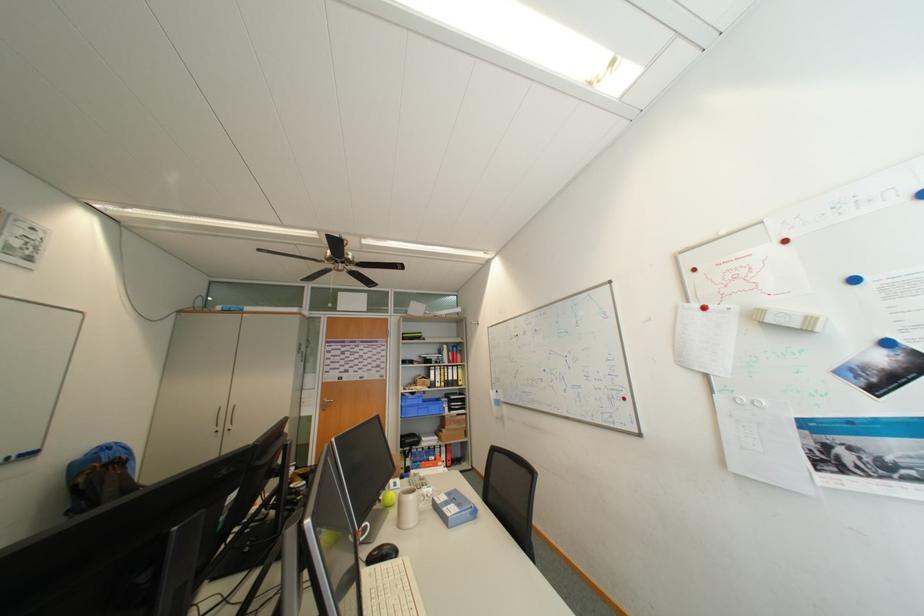
The width and height of the screenshot is (924, 616). What do you see at coordinates (517, 533) in the screenshot? I see `the chair sitting surface` at bounding box center [517, 533].